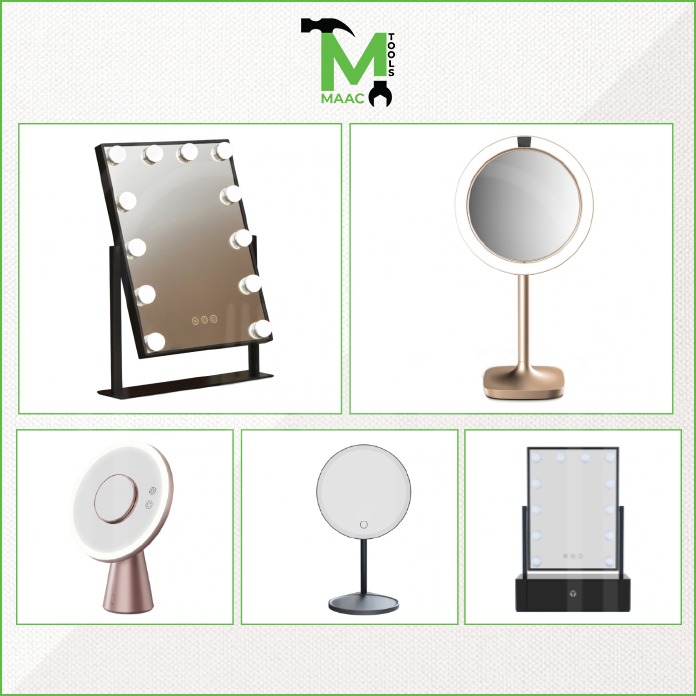
Locate an element on the screen. round mirror with bar lights surrounding edges is located at coordinates (106, 518).